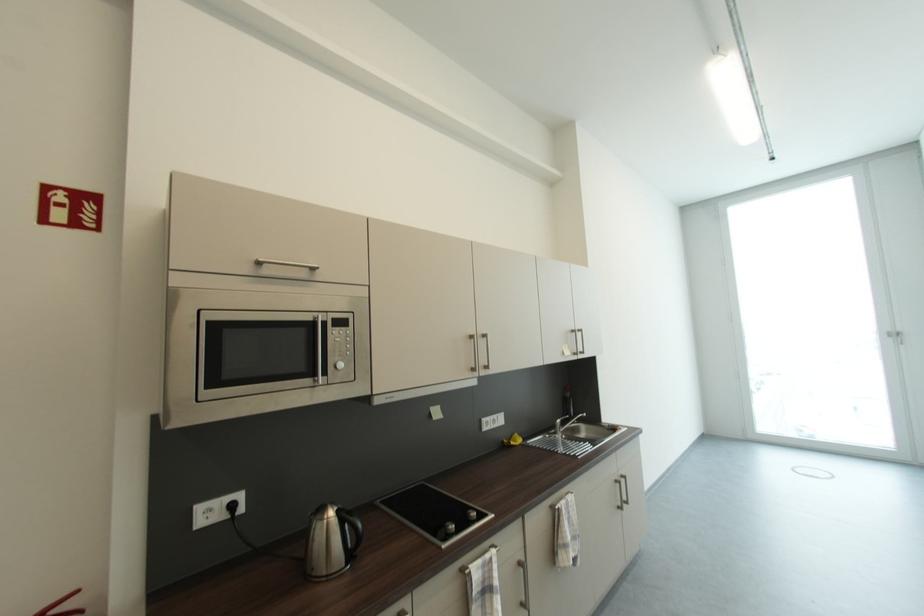
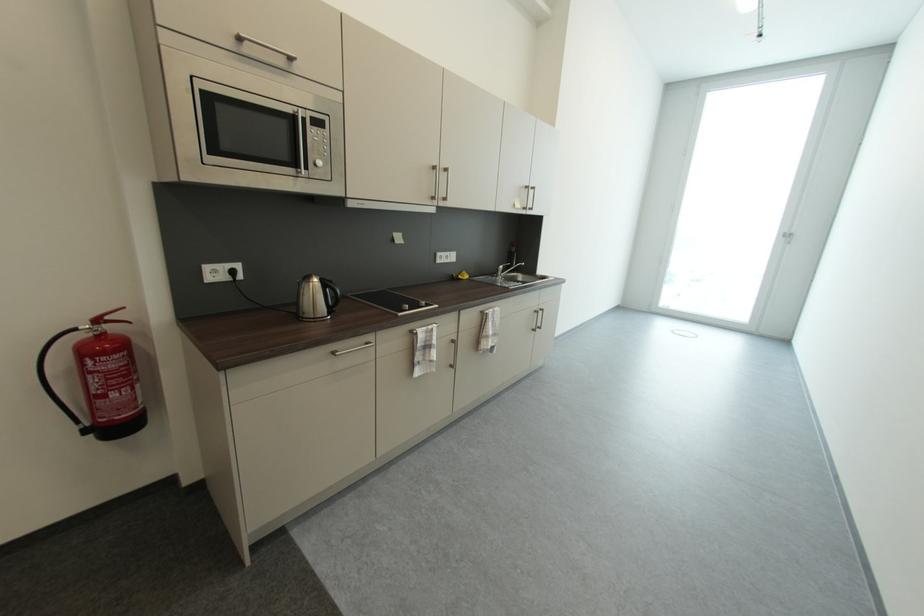
The point at (332,522) is marked in the first image. Where is the corresponding point in the second image?

(317, 285)